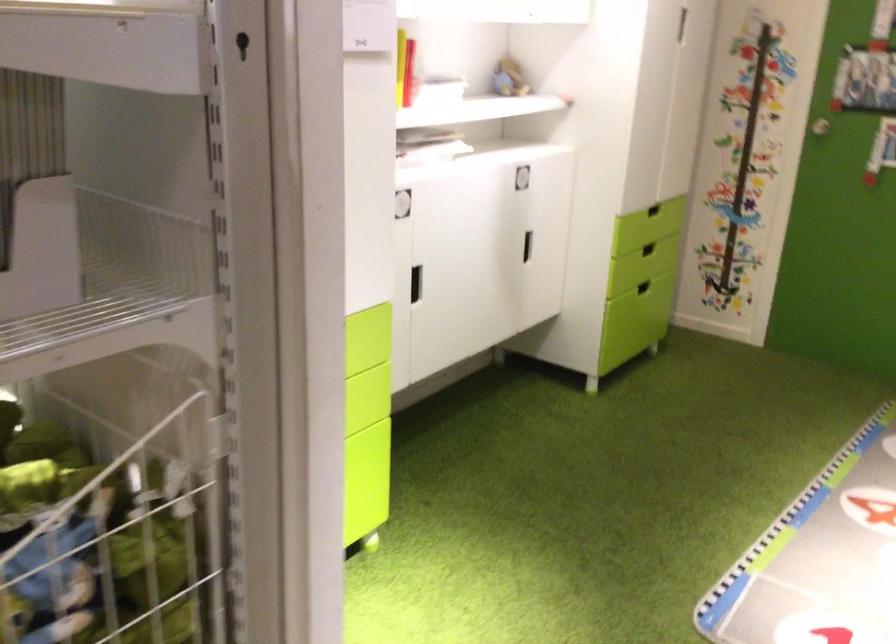
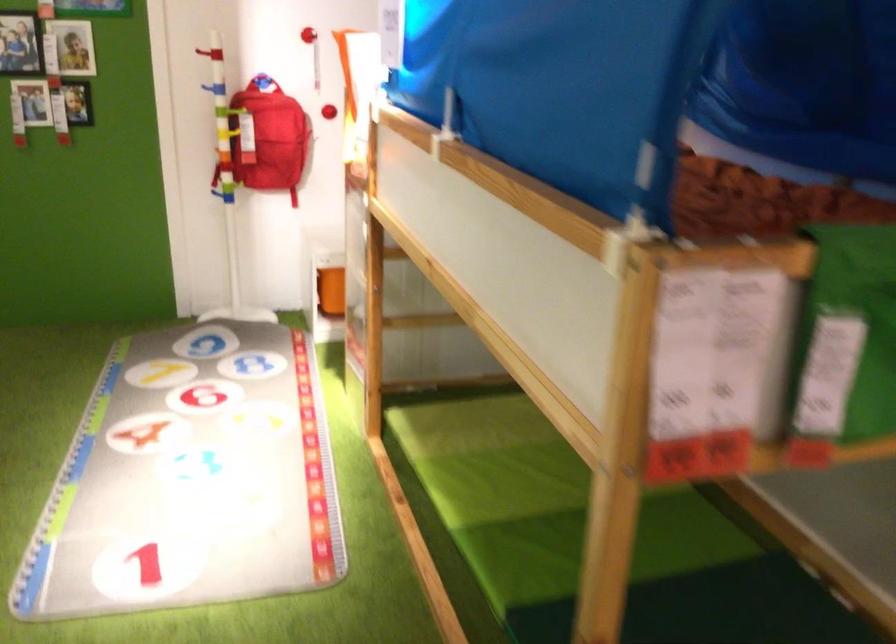
Question: The camera is either moving clockwise (left) or counter-clockwise (right) around the object. The first image is from the beginning of the video and the second image is from the end. Is the camera moving left or right when shooting the video?

Choices:
 (A) Left
 (B) Right

Answer: (A)